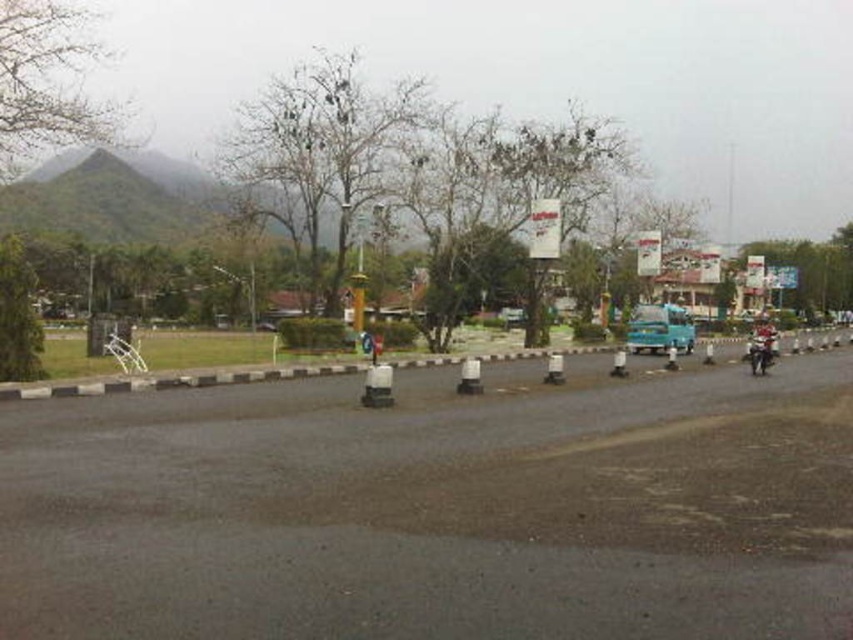
You are a pedestrian standing at the edge of the road and want to cross to the other side. You see the blue matte truck at center and the shiny silver motorcycle at right. Which vehicle is closer to you?

The blue matte truck at center is closer to you because it is positioned further to the viewer than the shiny silver motorcycle at right.

You are a pedestrian standing at the edge of the road. You see the blue matte truck at center and the shiny silver motorcycle at right. Which vehicle is closer to the right side of the road?

The shiny silver motorcycle at right is closer to the right side of the road because it is positioned to the right of the blue matte truck at center.

You are a delivery driver who needs to park your vehicle in a spot that can accommodate both the blue matte truck at center and the shiny silver motorcycle at right side by side. Based on the scene, will there be enough space if you place them next to each other?

The blue matte truck at center is wider than the shiny silver motorcycle at right, but without knowing the exact width of the parking spot, it is impossible to determine if there will be enough space to park them side by side.